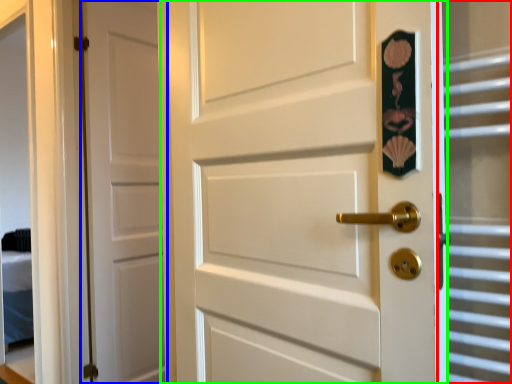
Question: Which is farther away from glass door (highlighted by a red box)? door (highlighted by a blue box) or door (highlighted by a green box)?

Choices:
 (A) door
 (B) door

Answer: (A)